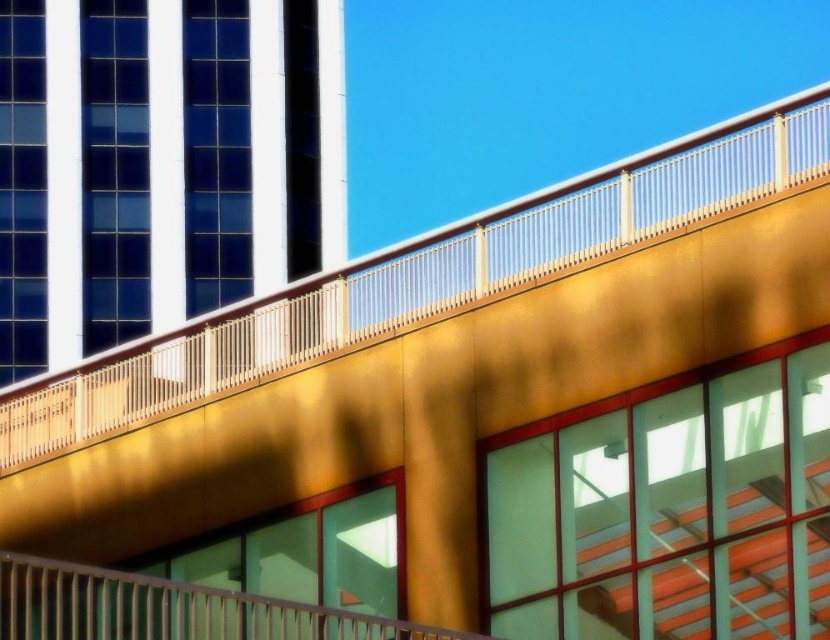
Looking at this image, what are the coordinates of the gold metallic balcony at upper center?

The gold metallic balcony at upper center is located at coordinates point (423, 276).

You are standing on the metallic silver railing at center and want to reach the gold metallic balcony at upper center. Which direction should you move to get there?

The gold metallic balcony at upper center is located above the metallic silver railing at center, so you should move upward to reach it.